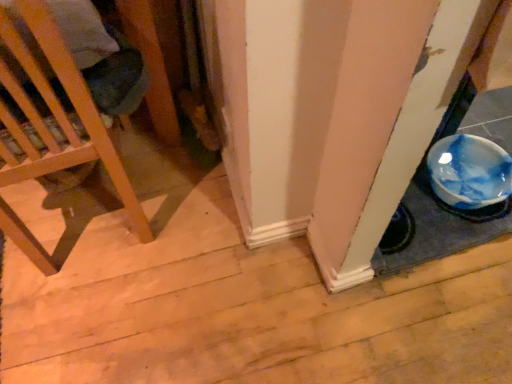
Image resolution: width=512 pixels, height=384 pixels. I want to click on vacant space underneath wooden chair at left (from a real-world perspective), so click(x=82, y=211).